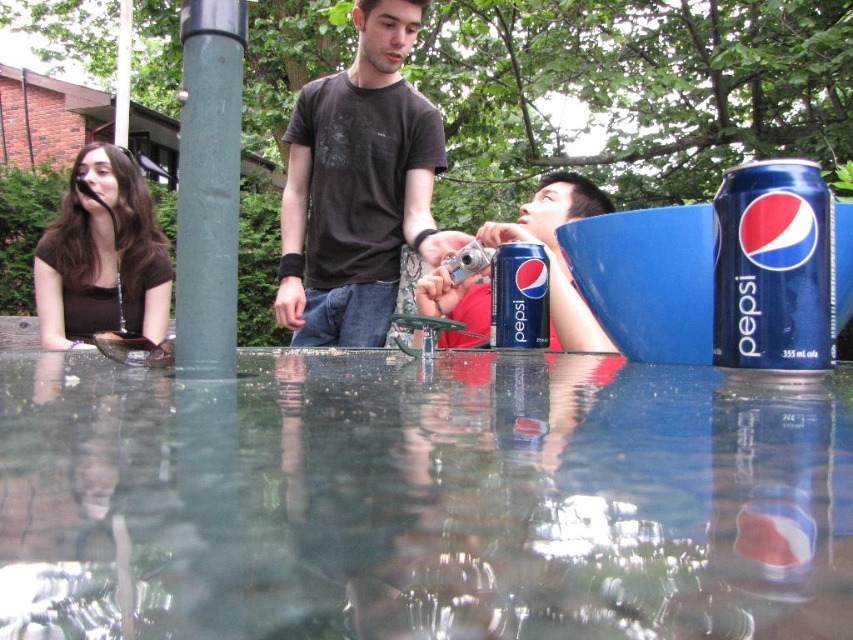
Question: Which point appears closest to the camera in this image?

Choices:
 (A) (816, 280)
 (B) (548, 241)

Answer: (A)

Question: Considering the real-world distances, which object is farthest from the blue metallic can at right?

Choices:
 (A) dark brown cotton t-shirt at center
 (B) brown matte shirt at left
 (C) metallic silver camera at center
 (D) transparent glass water at center

Answer: (B)

Question: Is transparent glass water at center bigger than blue metallic can at center?

Choices:
 (A) no
 (B) yes

Answer: (B)

Question: Is green matte pole at left positioned in front of brown matte shirt at left?

Choices:
 (A) no
 (B) yes

Answer: (B)

Question: Estimate the real-world distances between objects in this image. Which object is closer to the blue metallic can at right?

Choices:
 (A) metallic silver camera at center
 (B) green matte pole at left
 (C) brown matte shirt at left

Answer: (B)

Question: Does transparent glass water at center have a greater width compared to metallic silver camera at center?

Choices:
 (A) yes
 (B) no

Answer: (A)